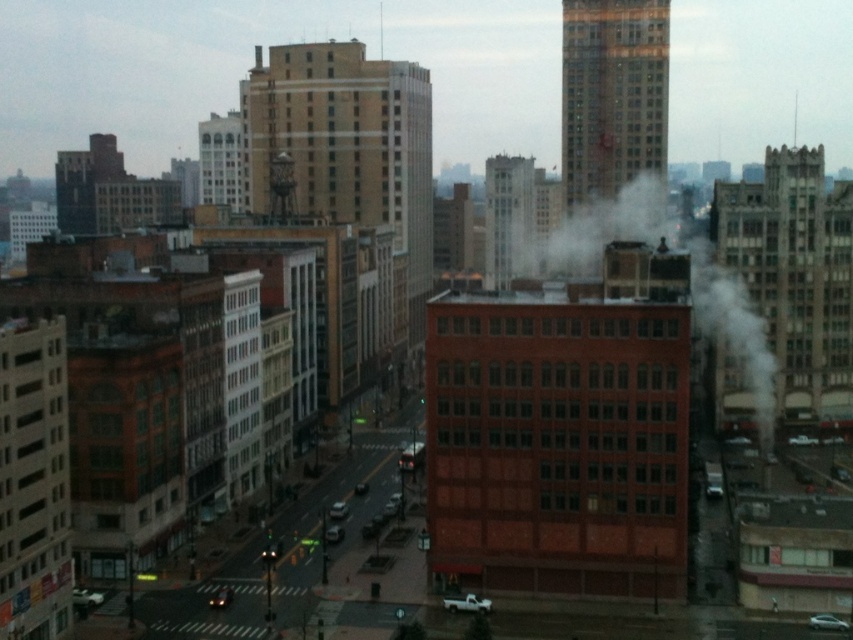
Looking at this image, does white smoke at center appear on the right side of smooth white tower at center?

Indeed, white smoke at center is positioned on the right side of smooth white tower at center.

Describe the element at coordinates (689, 284) in the screenshot. I see `white smoke at center` at that location.

Where is `white smoke at center`? white smoke at center is located at coordinates (689, 284).

Does brick building at left appear on the right side of smooth white tower at center?

No, brick building at left is not to the right of smooth white tower at center.

Is point (38, 339) positioned after point (500, 260)?

No, (38, 339) is in front of (500, 260).

The height and width of the screenshot is (640, 853). Identify the location of brick building at left. click(33, 481).

Can you confirm if brick building at upper right is positioned below smooth white tower at center?

Yes, brick building at upper right is below smooth white tower at center.

Between brick building at upper right and smooth white tower at center, which one appears on the left side from the viewer's perspective?

smooth white tower at center

Is point (651, 172) farther from camera compared to point (517, 182)?

No, (651, 172) is closer to viewer.

Where is `brick building at upper right`? brick building at upper right is located at coordinates (612, 93).